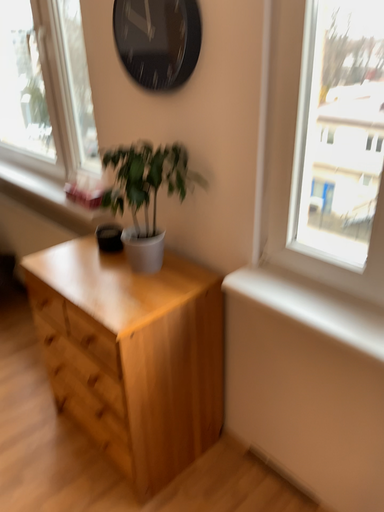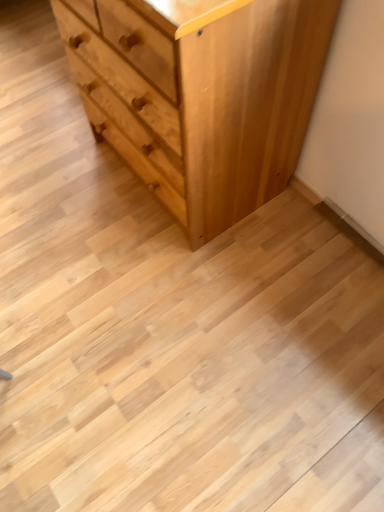
Question: Which way did the camera rotate in the video?

Choices:
 (A) rotated upward
 (B) rotated downward

Answer: (B)